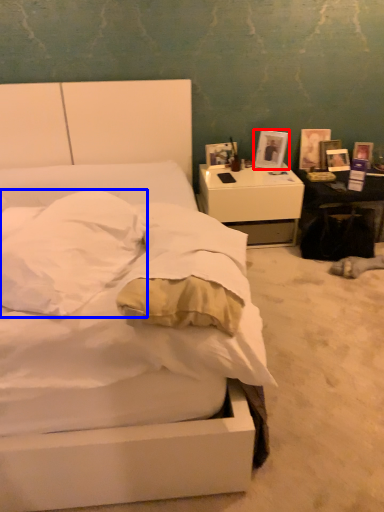
Question: Which point is further to the camera, picture frame (highlighted by a red box) or pillow (highlighted by a blue box)?

Choices:
 (A) picture frame
 (B) pillow

Answer: (A)